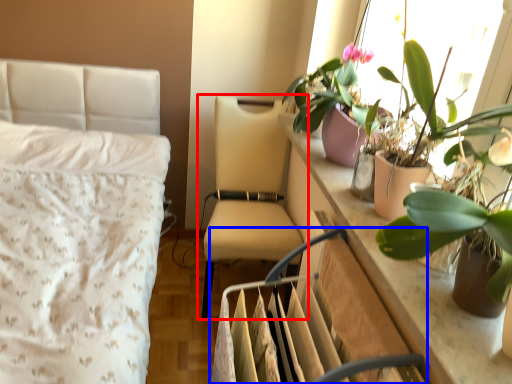
Question: Which point is further to the camera, chair (highlighted by a red box) or swivel chair (highlighted by a blue box)?

Choices:
 (A) chair
 (B) swivel chair

Answer: (A)